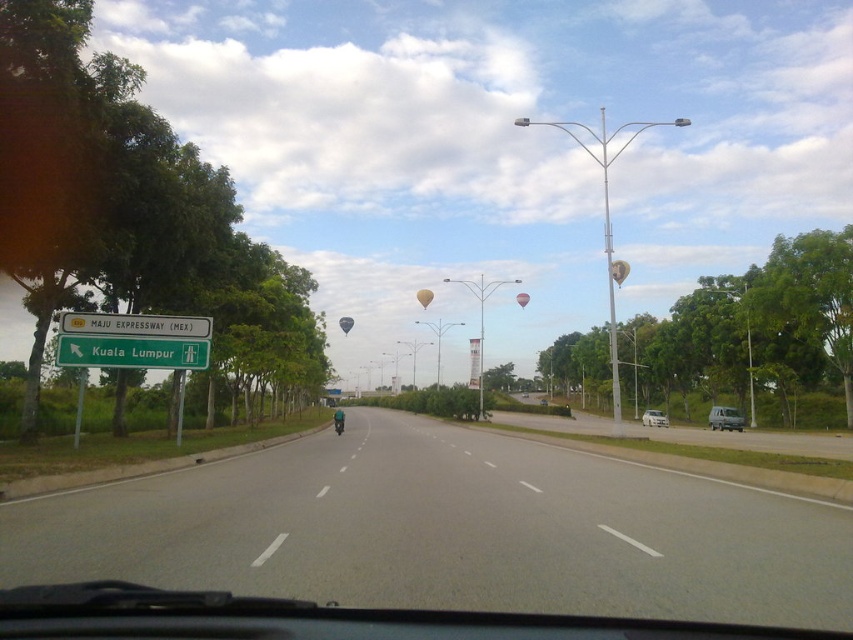
Can you confirm if matte silver suv at right is smaller than pink fabric balloon at center?

Yes.

Between point (734, 428) and point (515, 296), which one is positioned behind?

The point (515, 296) is behind.

Between point (733, 410) and point (515, 300), which one is positioned in front?

Point (733, 410) is in front.

This screenshot has width=853, height=640. I want to click on matte silver suv at right, so click(724, 419).

Is silver metallic sedan at center positioned in front of beige fabric balloon at center?

Yes.

Is silver metallic sedan at center to the left of beige fabric balloon at center from the viewer's perspective?

Incorrect, silver metallic sedan at center is not on the left side of beige fabric balloon at center.

The width and height of the screenshot is (853, 640). Find the location of `silver metallic sedan at center`. silver metallic sedan at center is located at coordinates (654, 419).

I want to click on yellowmaterial/texturestreet sign at left, so click(134, 324).

Does yellowmaterial/texturestreet sign at left appear on the left side of pink fabric balloon at center?

Correct, you'll find yellowmaterial/texturestreet sign at left to the left of pink fabric balloon at center.

Which is behind, point (194, 317) or point (521, 305)?

Positioned behind is point (521, 305).

Locate an element on the screen. yellowmaterial/texturestreet sign at left is located at coordinates point(134,324).